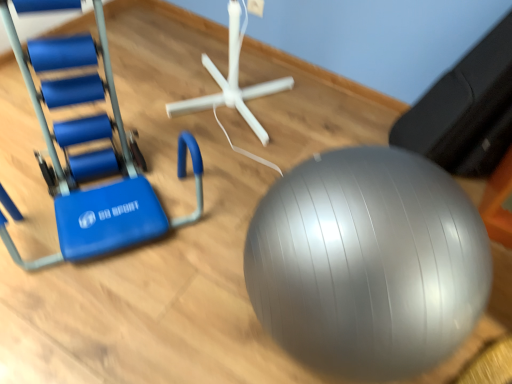
Where is `free space in front of blue rubber swivel chair at left`? free space in front of blue rubber swivel chair at left is located at coordinates (100, 319).